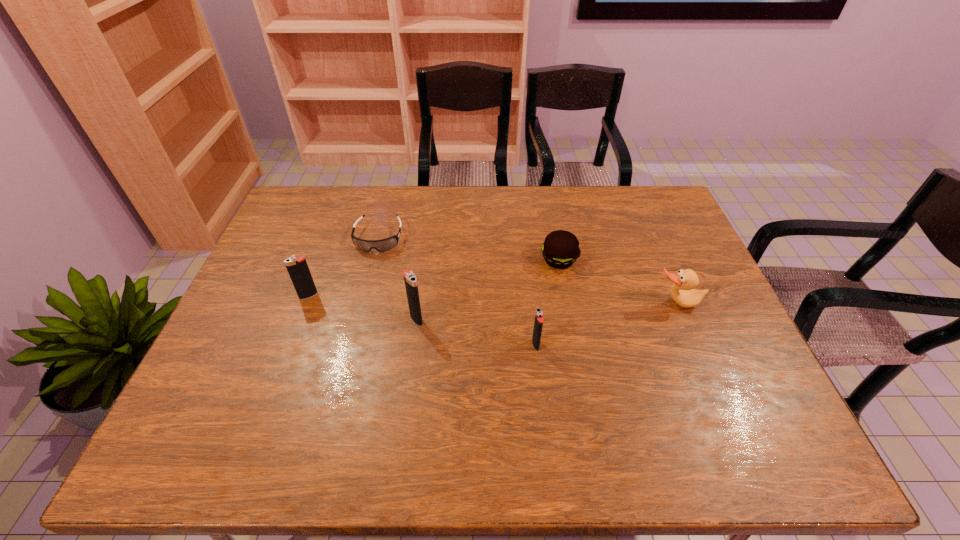
The height and width of the screenshot is (540, 960). Identify the location of the leftmost object. (298, 269).

Identify the location of the second tallest igniter. (298, 269).

Image resolution: width=960 pixels, height=540 pixels. Find the location of `the second igniter from left to right`. the second igniter from left to right is located at coordinates (410, 279).

You are a GUI agent. You are given a task and a screenshot of the screen. Output one action in this format:
    pyautogui.click(x=<x>, y=<y>)
    Task: Click on the third object from left to right
    This screenshot has height=540, width=960.
    Given the screenshot: What is the action you would take?
    pyautogui.click(x=410, y=279)

Locate an element on the screen. This screenshot has height=540, width=960. the rightmost igniter is located at coordinates (538, 323).

Image resolution: width=960 pixels, height=540 pixels. What are the coordinates of `the nearest igniter` in the screenshot? It's located at tap(538, 323).

Where is `goggles`? This screenshot has height=540, width=960. goggles is located at coordinates (383, 245).

Image resolution: width=960 pixels, height=540 pixels. What are the coordinates of `the shortest object` in the screenshot? It's located at (383, 245).

Identify the location of the rightmost object. The image size is (960, 540). (683, 293).

Locate an element on the screen. Image resolution: width=960 pixels, height=540 pixels. the fifth tallest object is located at coordinates (560, 249).